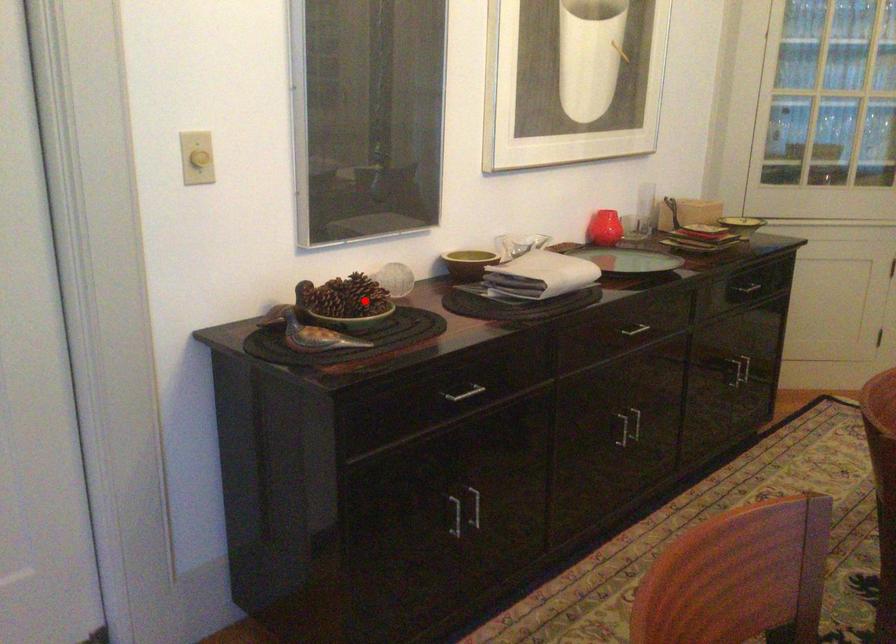
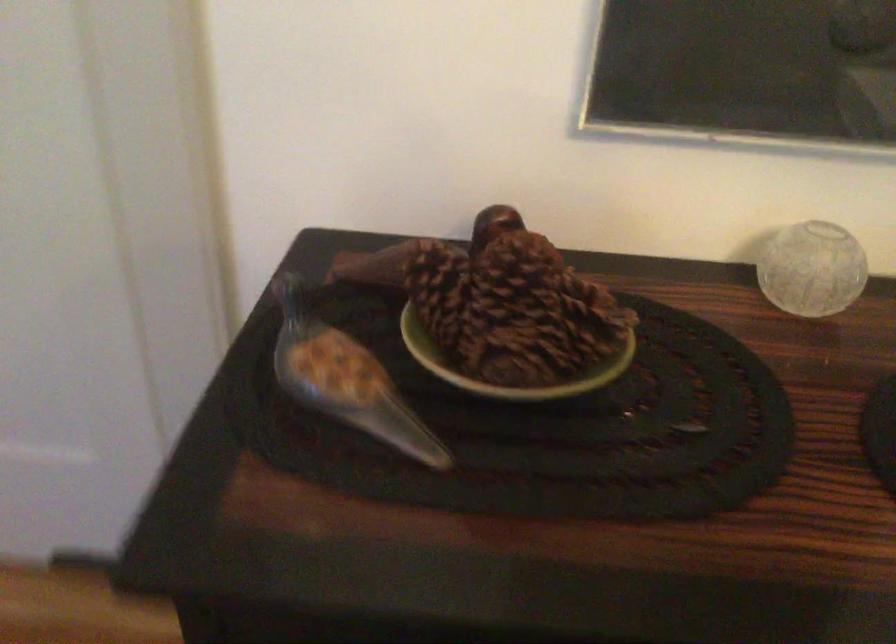
Question: I am providing you with two images of the same scene from different viewpoints. Image1 has a red point marked. In image2, the corresponding 3D location appears at what relative position? Reply with the corresponding letter.

Choices:
 (A) Closer
 (B) Farther

Answer: (A)